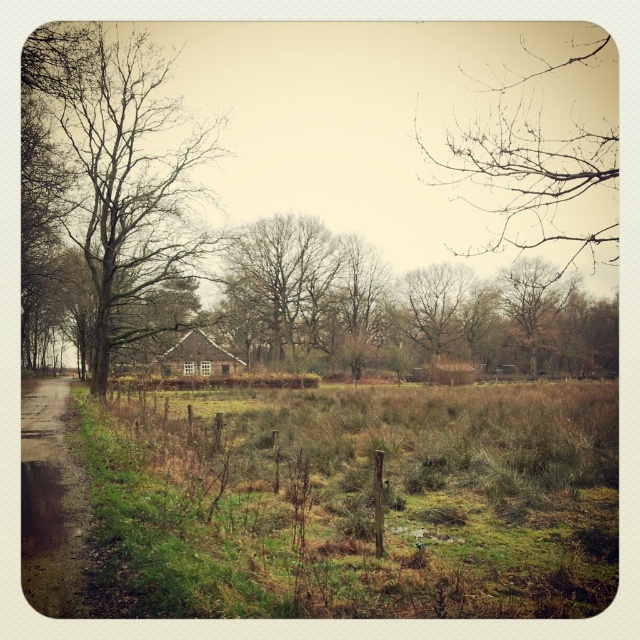
You are standing at the edge of the green grassy field at center and want to reach the brown wooden hut at center. Which direction should you walk to get there?

The green grassy field at center is in front of the brown wooden hut at center, so you should walk forward towards the brown wooden hut at center to reach it.

You are a hiker trying to find the shortest path to the muddy dirt road. You have two options in the image, the green grassy field at center and the bare branches at left. Which path would require less walking distance?

The green grassy field at center is smaller than the bare branches at left, so choosing the green grassy field at center would require less walking distance.